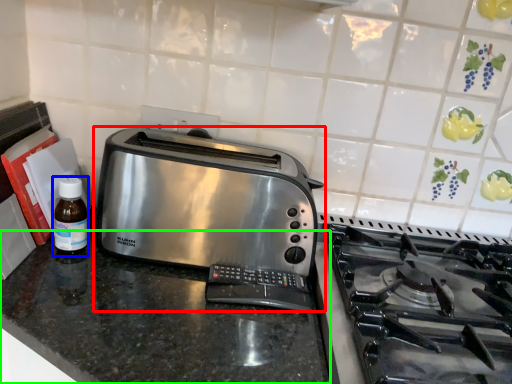
Question: Considering the real-world distances, which object is farthest from toaster (highlighted by a red box)? bottle (highlighted by a blue box) or counter (highlighted by a green box)?

Choices:
 (A) bottle
 (B) counter

Answer: (A)